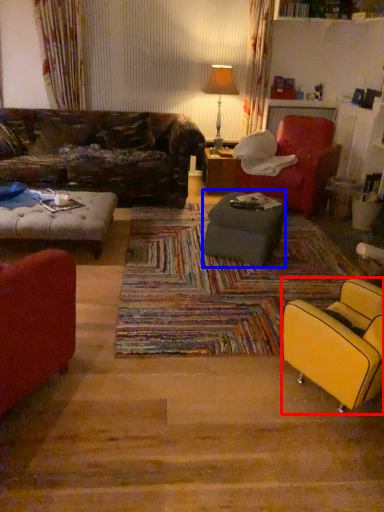
Question: Which object appears farthest to the camera in this image, chair (highlighted by a red box) or table (highlighted by a blue box)?

Choices:
 (A) chair
 (B) table

Answer: (B)